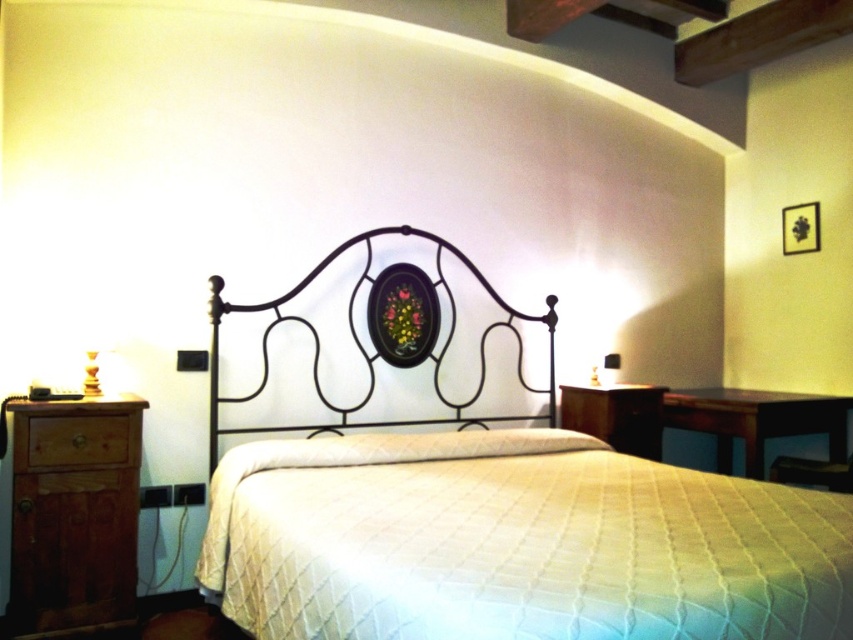
Question: Does brown wood dresser at left have a larger size compared to white quilted pillow at center?

Choices:
 (A) yes
 (B) no

Answer: (B)

Question: Which point is closer to the camera?

Choices:
 (A) (614, 365)
 (B) (396, 364)
 (C) (332, 445)
 (D) (117, 605)

Answer: (D)

Question: Does brown wood dresser at left appear over wooden lamp at right?

Choices:
 (A) no
 (B) yes

Answer: (A)

Question: Which is farther from the wooden lamp at right?

Choices:
 (A) brown wood dresser at left
 (B) white quilted bed at center
 (C) white quilted pillow at center
 (D) brown wooden drawer at left

Answer: (A)

Question: Which point appears farthest from the camera in this image?

Choices:
 (A) (614, 371)
 (B) (436, 368)

Answer: (A)

Question: In this image, where is white quilted pillow at center located relative to brown wooden drawer at left?

Choices:
 (A) left
 (B) right

Answer: (B)